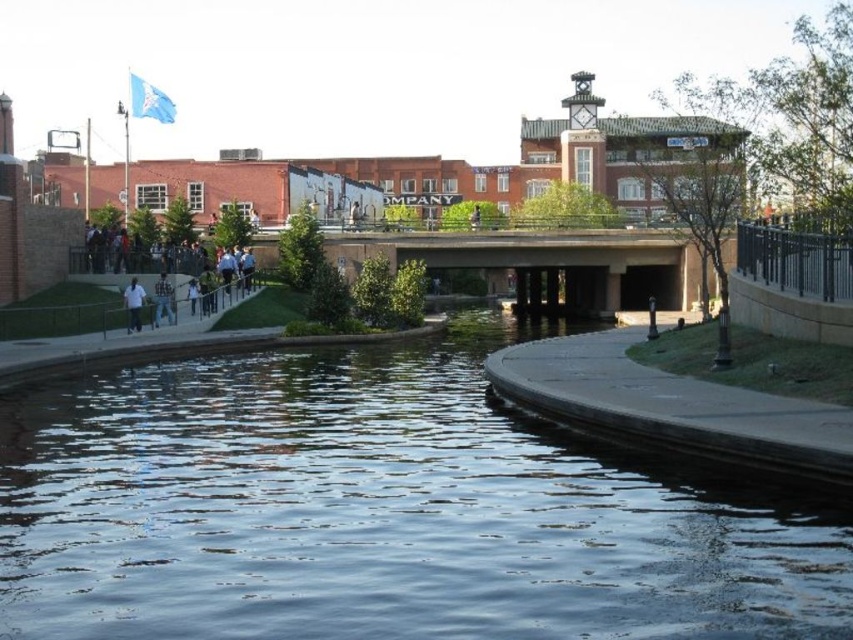
You are a photographer standing on the walkway near the flagpole. You want to take a photo of both the white matte shirt at lower left and the white cotton shirt at center. Which shirt should you focus on first to ensure both are in sharp focus?

You should focus on the white matte shirt at lower left first because it is closer to the viewer than the white cotton shirt at center. By focusing on the closer object, the farther one will also be in focus due to the depth of field.

You are a photographer trying to capture both the white matte shirt at lower left and the white cotton shirt at center in a single frame. Which of the two shirts should you focus on first to ensure they both are in the shot?

The white matte shirt at lower left is to the left of the white cotton shirt at center, so you should focus on the white cotton shirt at center first to ensure both are in the shot.

You are a delivery person carrying a large box that is 1 meter wide. You need to walk along the path to deliver it to the address on the white cotton shirt at center. Is the concrete sidewalk at lower left wide enough for your box?

The concrete sidewalk at lower left is wider than the white cotton shirt at center. Since the box is 1 meter wide, and the sidewalk is wider than the shirt, it should be sufficient for the delivery.